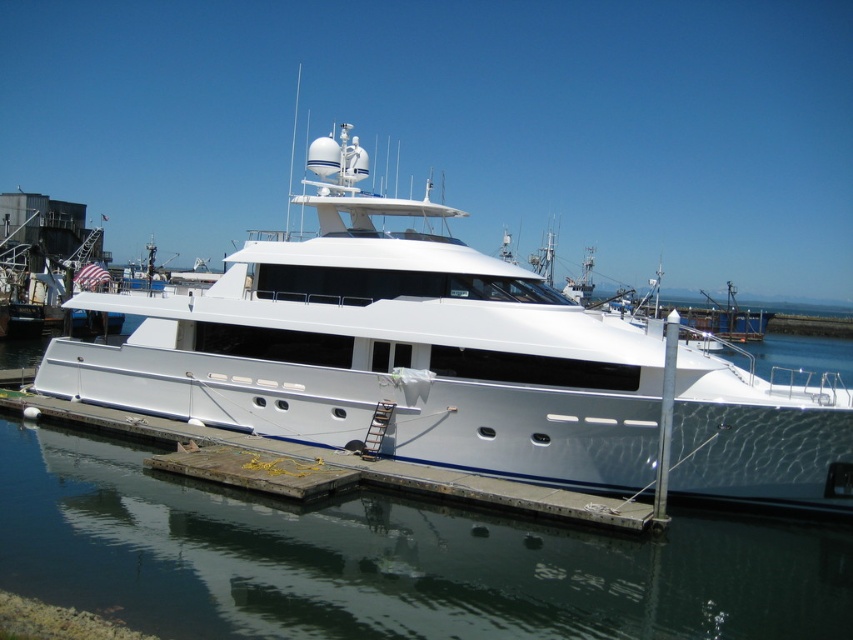
You are planning to board the yacht and need to know the size of the areas. Which area is larger in the image between the glossy metallic water at center and the concrete at center?

The glossy metallic water at center is bigger than concrete at center, so the glossy metallic water at center is larger in the image.

You are standing on the dock and see the white glossy yacht at center and the concrete at center. Which object is positioned to the right side from your perspective?

The white glossy yacht at center is to the right of the concrete at center, so the white glossy yacht at center is positioned to the right side from your perspective.